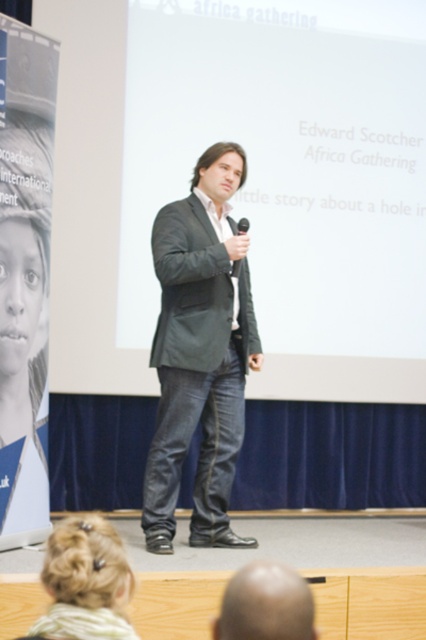
Is bald head at lower center to the right of black matte microphone at center from the viewer's perspective?

In fact, bald head at lower center is to the left of black matte microphone at center.

Identify the location of bald head at lower center. (265, 604).

Where is `bald head at lower center`? bald head at lower center is located at coordinates (265, 604).

I want to click on bald head at lower center, so click(x=265, y=604).

Who is taller, white matte projection screen at center or bald head at lower center?

With more height is white matte projection screen at center.

Is white matte projection screen at center positioned at the back of bald head at lower center?

Yes, white matte projection screen at center is further from the viewer.

Is point (288, 218) positioned in front of point (282, 566)?

No.

Locate an element on the screen. This screenshot has width=426, height=640. white matte projection screen at center is located at coordinates (291, 177).

Can you confirm if white matte projection screen at center is thinner than blonde hair bun at lower left?

Incorrect, white matte projection screen at center's width is not less than blonde hair bun at lower left's.

Does white matte projection screen at center appear under blonde hair bun at lower left?

No, white matte projection screen at center is not below blonde hair bun at lower left.

Which is behind, point (394, 284) or point (129, 593)?

Positioned behind is point (394, 284).

Identify the location of white matte projection screen at center. 291,177.